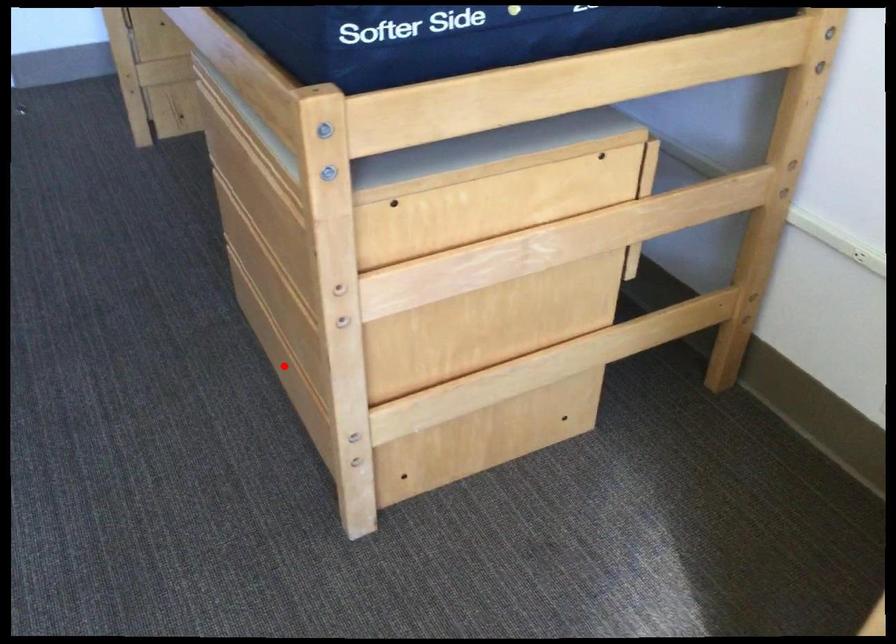
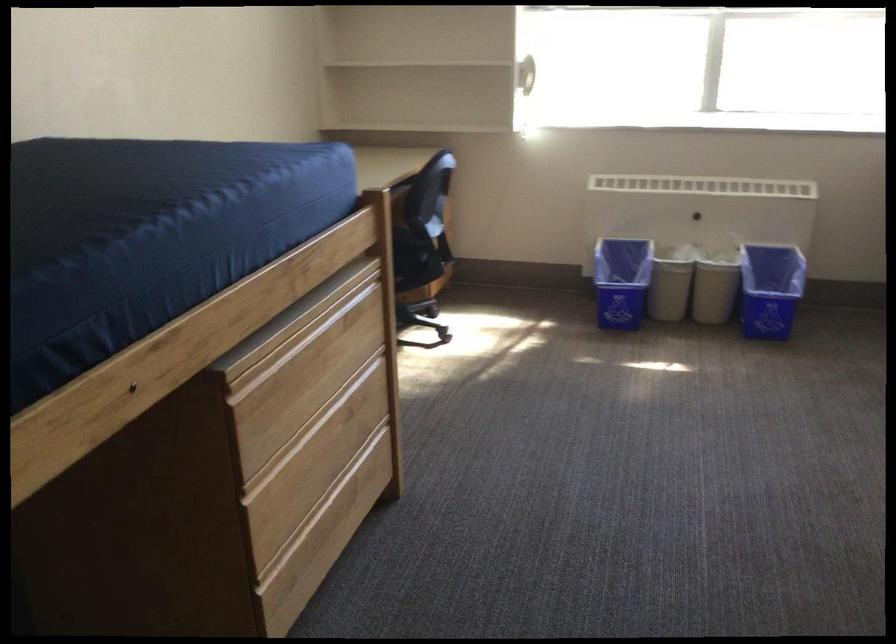
The point at the highlighted location is marked in the first image. Where is the corresponding point in the second image?

(330, 523)